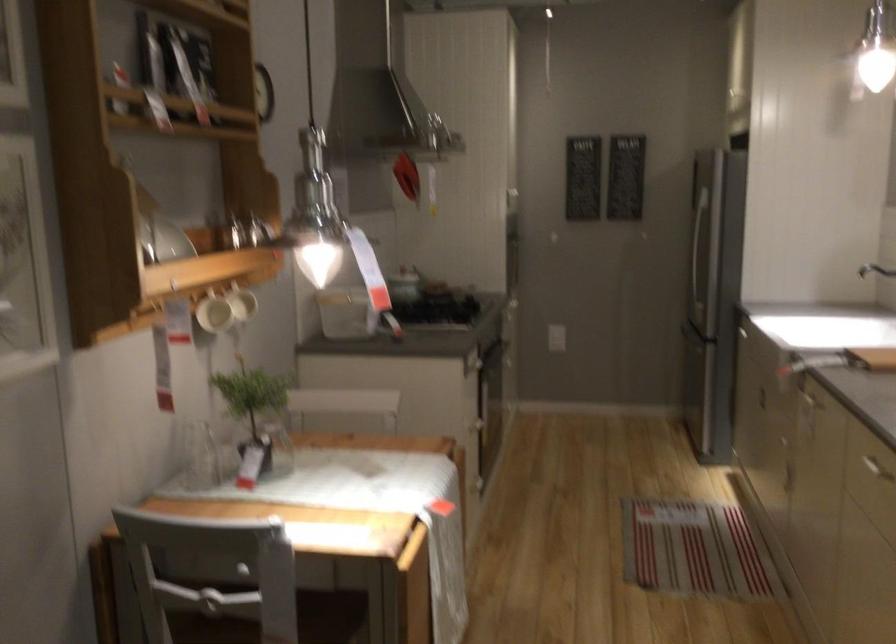
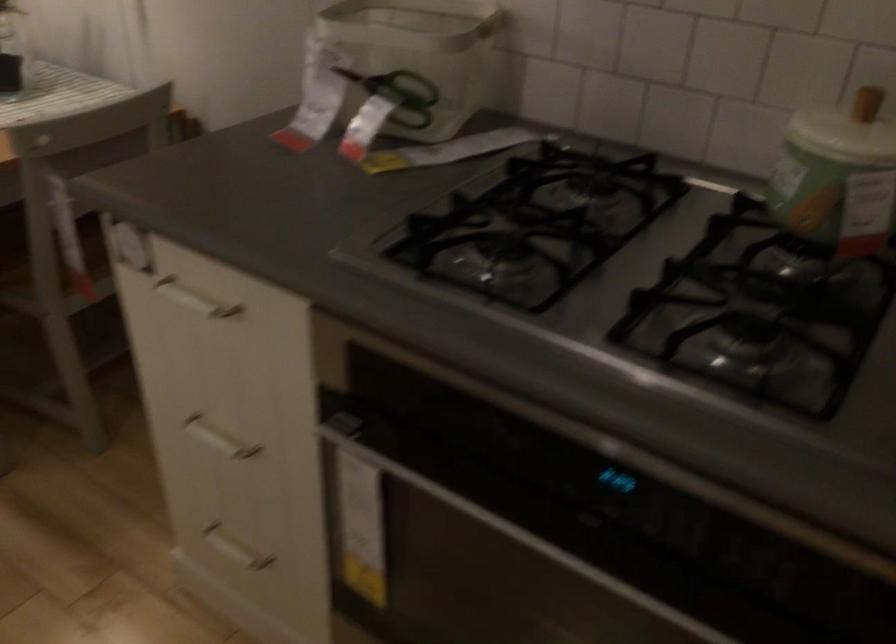
In the second image, find the point that corresponds to pixel 487 491 in the first image.

(234, 549)